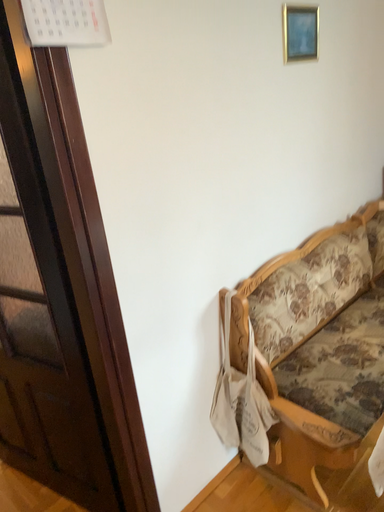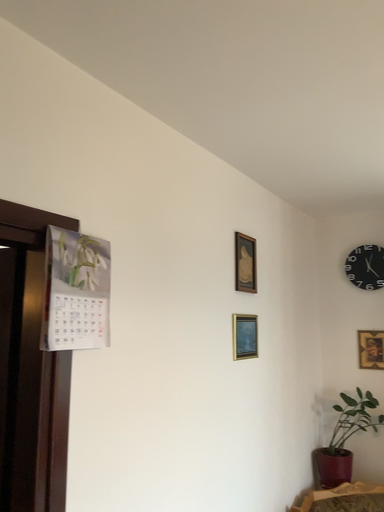
Question: How did the camera likely rotate when shooting the video?

Choices:
 (A) rotated right
 (B) rotated left

Answer: (A)